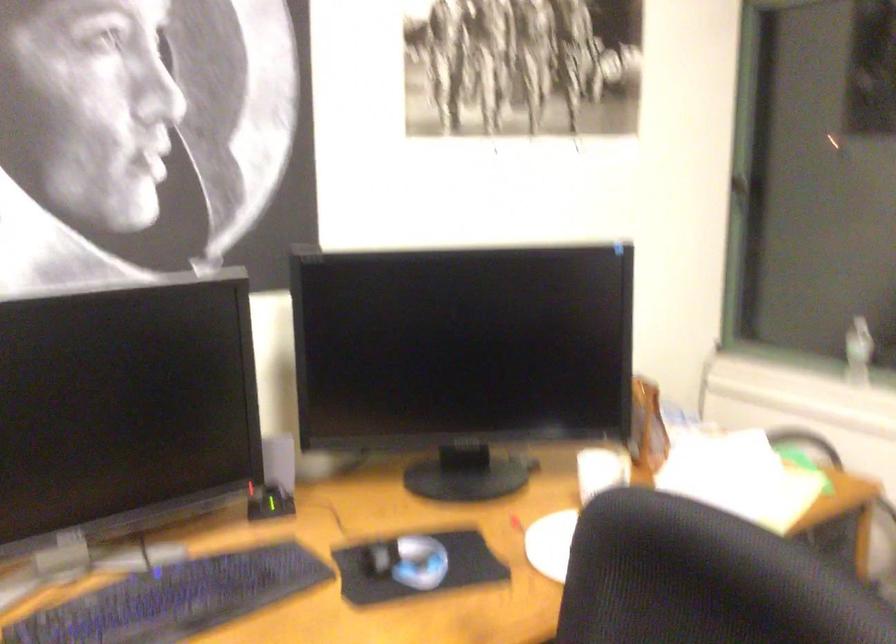
Where would you slid the computer mouse? Please return your answer as a coordinate pair (x, y).

(380, 558)